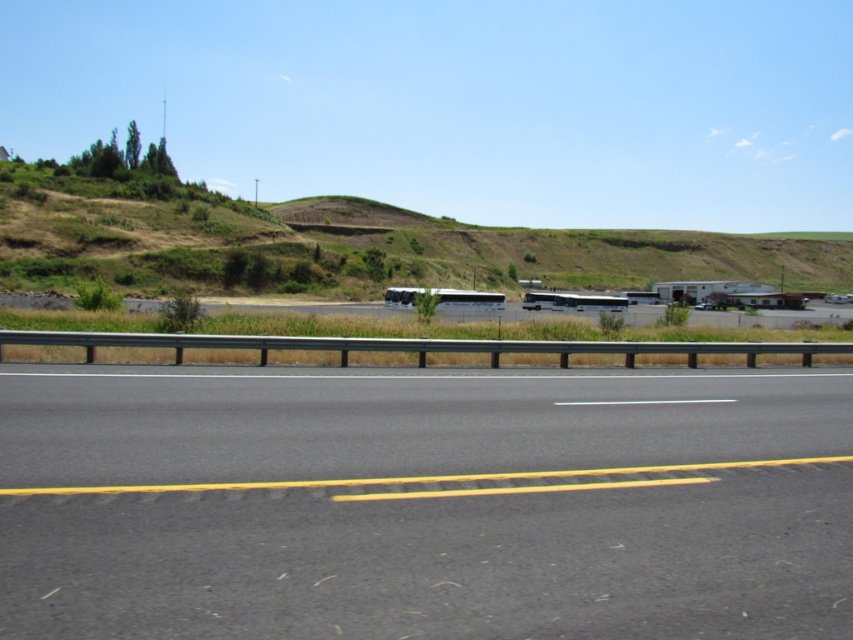
Question: In this image, where is black asphalt road at center located relative to metallic silver bus at center?

Choices:
 (A) below
 (B) above

Answer: (A)

Question: Which point is closer to the camera?

Choices:
 (A) (776, 547)
 (B) (113, 257)

Answer: (A)

Question: Can you confirm if green grassy hillside at upper center is positioned below metallic silver recreational vehicle at center?

Choices:
 (A) yes
 (B) no

Answer: (B)

Question: Among these objects, which one is nearest to the camera?

Choices:
 (A) metallic silver recreational vehicle at center
 (B) black asphalt road at center

Answer: (B)

Question: Is green grassy hillside at upper center below metallic silver bus at center?

Choices:
 (A) yes
 (B) no

Answer: (B)

Question: Which point appears closest to the camera in this image?

Choices:
 (A) (541, 532)
 (B) (218, 259)
 (C) (584, 300)

Answer: (A)